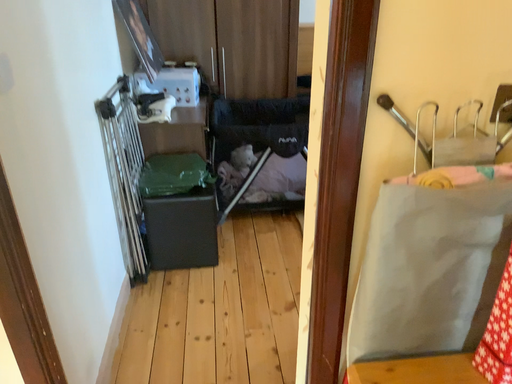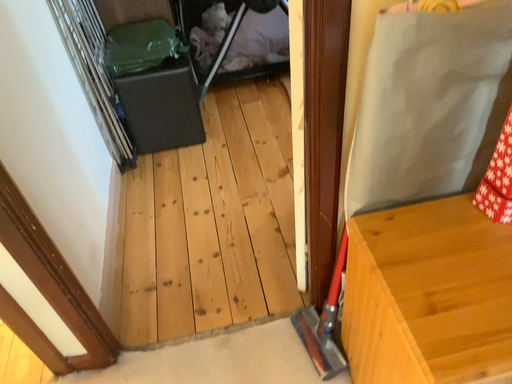
Question: Which way did the camera rotate in the video?

Choices:
 (A) rotated upward
 (B) rotated downward

Answer: (B)